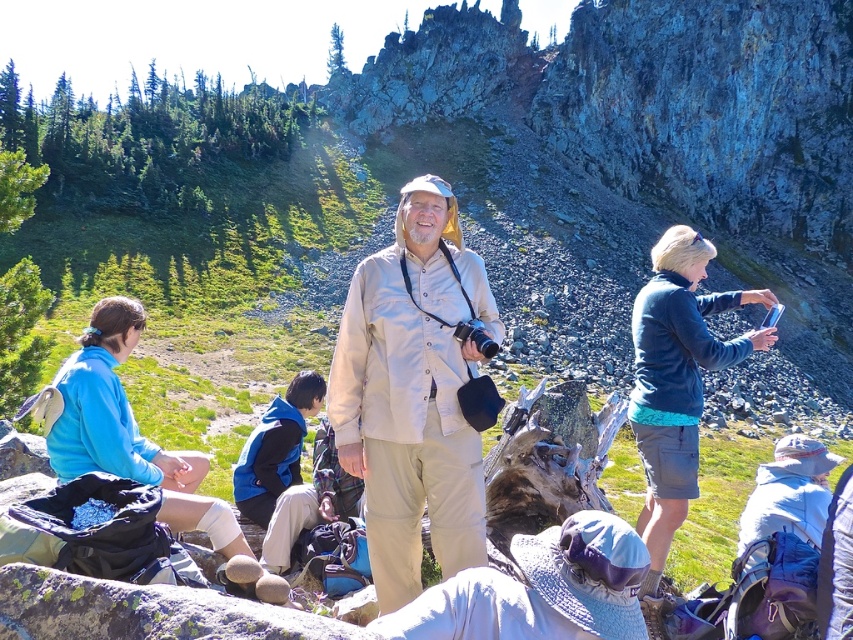
You are planning to place a rectangular box that is 1.2 meters wide between the dark blue fleece at right and the blue fleece jacket at lower left. Based on their widths, will the box fit without overlapping either item?

The dark blue fleece at right might be wider than blue fleece jacket at lower left, but since the exact width difference isn

You are a photographer trying to capture the dark blue fleece at right in your shot. The camera you are using has a rectangular viewfinder with coordinates ranging from 0 to 1 on both axes. The fleece is located at point 0.594 on the x axis and 0.795 on the y axis. To ensure the fleece is centered in the viewfinder, what adjustments should you make to the camera position?

The dark blue fleece at right is located at coordinates 0.594 on the x axis and 0.795 on the y axis. To center it in the viewfinder, adjust the camera so the center of the viewfinder aligns with these coordinates.

You are a photographer trying to capture a group shot of the beige fabric shirt at center and the blue fleece jacket at lower left. Since you want to ensure both subjects are fully visible, which subject requires a wider lens setting to avoid cropping? Explain your reasoning based on their sizes in the scene.

The blue fleece jacket at lower left requires a wider lens setting because it is wider than the beige fabric shirt at center, so a wider lens can capture its full width without cropping.